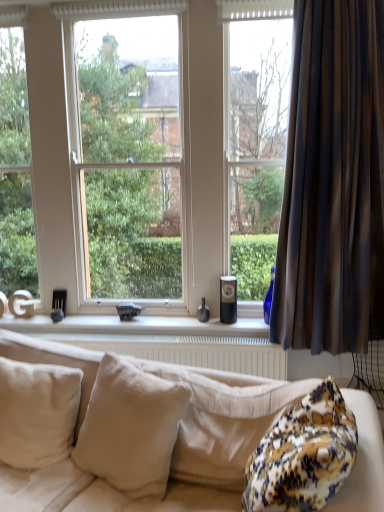
This screenshot has height=512, width=384. Identify the location of free point above white textured radiator at lower center (from a real-world perspective). (94, 336).